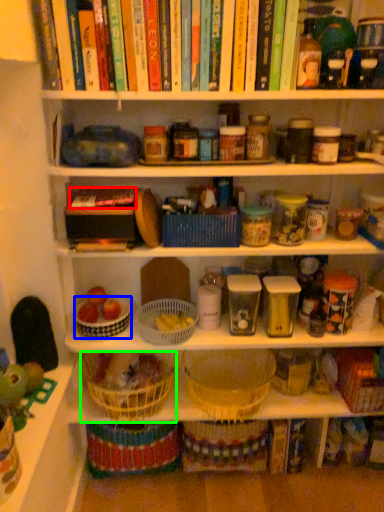
Question: Estimate the real-world distances between objects in this image. Which object is closer to book (highlighted by a red box), basket (highlighted by a blue box) or basket (highlighted by a green box)?

Choices:
 (A) basket
 (B) basket

Answer: (A)